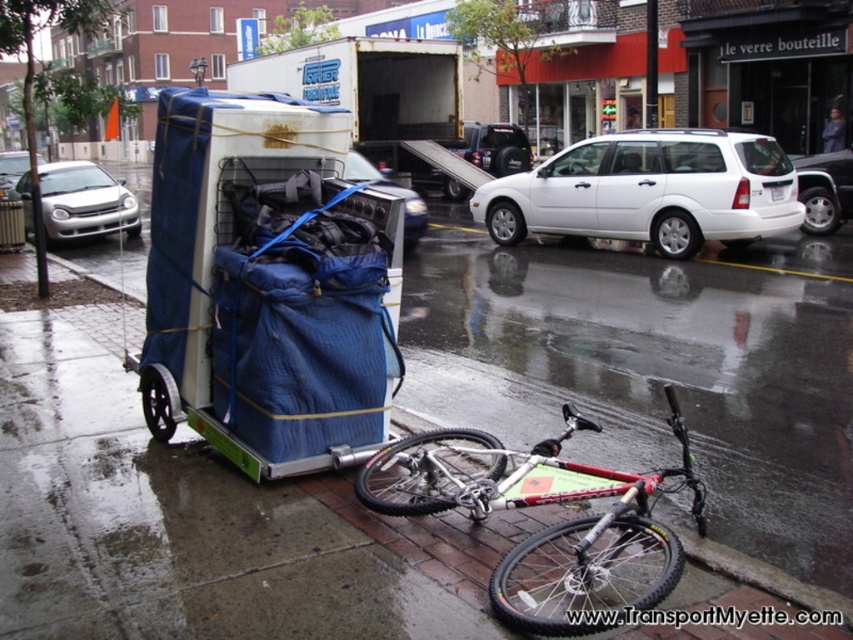
Question: Where is metallic blue suitcase at center located in relation to silver metallic sedan at left in the image?

Choices:
 (A) right
 (B) left

Answer: (A)

Question: Which point is closer to the camera?

Choices:
 (A) (704, 166)
 (B) (6, 163)
 (C) (838, 225)
 (D) (53, 193)

Answer: (A)

Question: Is blue fabric cart at left above silver metallic sedan at right?

Choices:
 (A) no
 (B) yes

Answer: (A)

Question: Which of the following is the closest to the observer?

Choices:
 (A) silver metallic sedan at left
 (B) blue fabric cart at left
 (C) silver metallic sedan at right

Answer: (B)

Question: Which of these objects is positioned closest to the silver metallic hatchback at left?

Choices:
 (A) metallic blue suitcase at center
 (B) white matte station wagon at center
 (C) silver metallic sedan at right

Answer: (A)

Question: Does blue fabric cart at left appear on the left side of silver metallic hatchback at left?

Choices:
 (A) yes
 (B) no

Answer: (B)